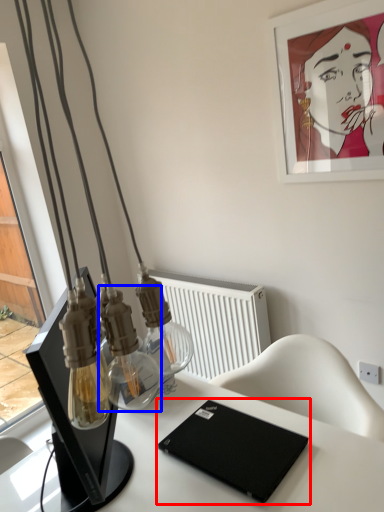
Question: Which object appears farthest to the camera in this image, laptop (highlighted by a red box) or bottle (highlighted by a blue box)?

Choices:
 (A) laptop
 (B) bottle

Answer: (B)